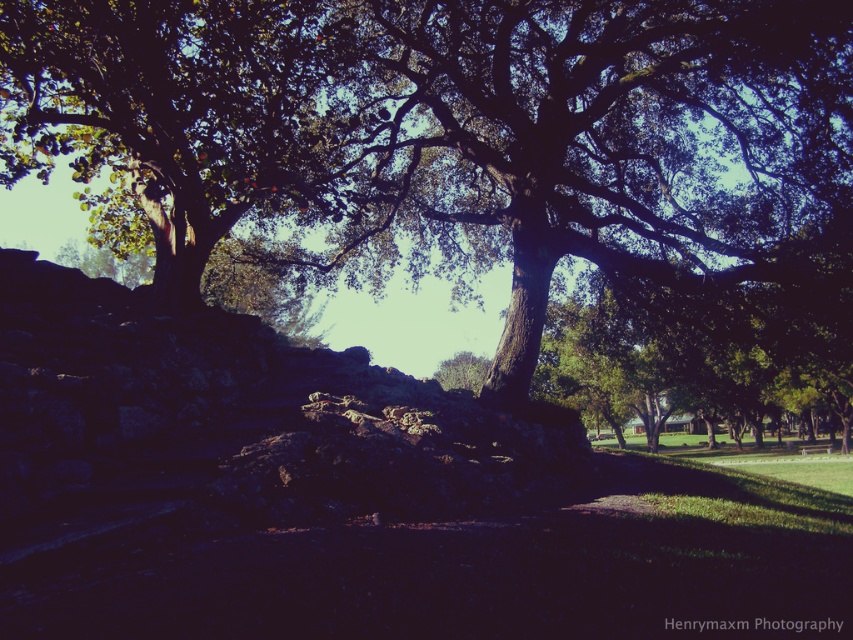
Question: Which of the following is the closest to the observer?

Choices:
 (A) (450, 266)
 (B) (173, 128)

Answer: (B)

Question: Can you confirm if green leafy tree at center is positioned to the right of green leafy tree at upper left?

Choices:
 (A) yes
 (B) no

Answer: (A)

Question: Which object appears closest to the camera in this image?

Choices:
 (A) green leafy tree at upper left
 (B) green leafy tree at center

Answer: (A)

Question: Is the position of green leafy tree at center more distant than that of green leafy tree at upper left?

Choices:
 (A) yes
 (B) no

Answer: (A)

Question: Is green leafy tree at center to the right of green leafy tree at upper left from the viewer's perspective?

Choices:
 (A) yes
 (B) no

Answer: (A)

Question: Which point appears closest to the camera in this image?

Choices:
 (A) (198, 282)
 (B) (509, 353)

Answer: (A)